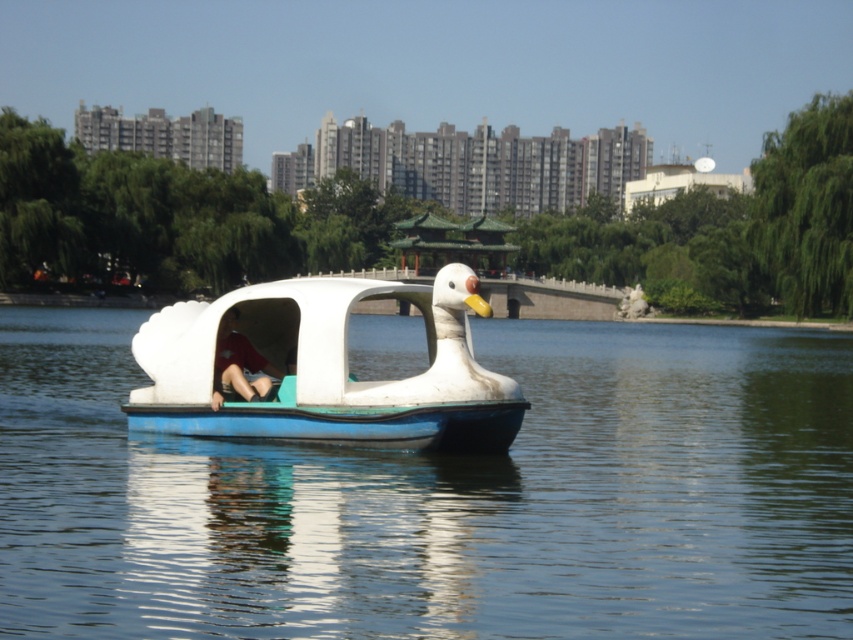
You are a photographer standing at the edge of the water. You want to take a photo of the white matte duck boat at center and the matte red shirt at center. Which object should you zoom in on to capture both subjects clearly in the frame?

The white matte duck boat at center is larger in size than the matte red shirt at center, so you should zoom in on the white matte duck boat at center to ensure both subjects fit clearly in the frame.

From the picture: You are standing at the point with coordinates point (216, 403) and want to move towards the point with coordinates point (294, 328). Which direction should you go?

You should move forward because point (294, 328) is behind point (216, 403), meaning it is in the direction you are facing.